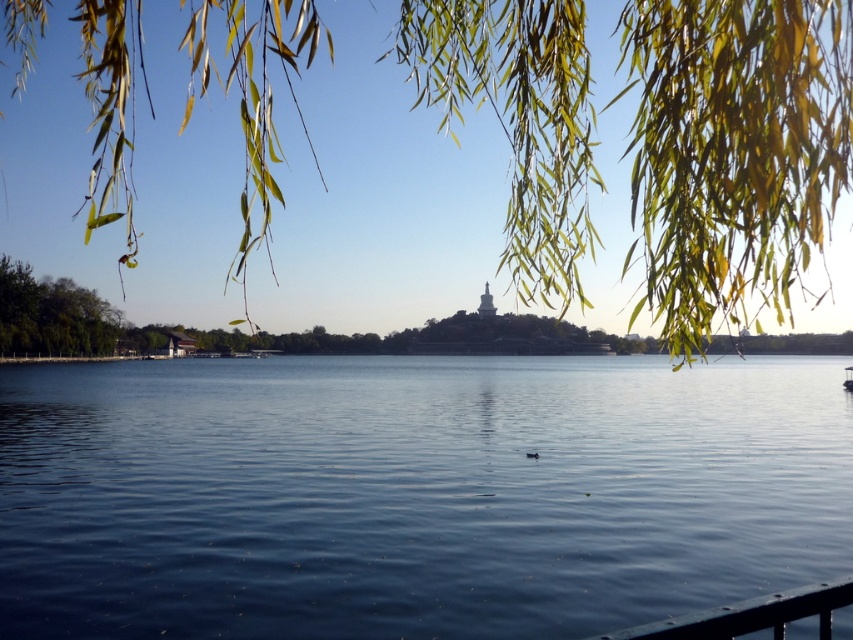
You are standing at the center of the lake and looking towards the green leafy willow at upper center. In which direction should you swim to reach it?

The green leafy willow at upper center is located at point coordinates that indicate it is positioned to the upper left from your current position at the lake center. Therefore, you should swim towards the upper left direction to reach it.

You are a photographer trying to capture the entire lakeside scene without any obstructions. You notice the green leafy willow at upper center. Based on its position, will it block your view of the lake? Please explain.

The green leafy willow at upper center is positioned at point (654, 145), which means it is located near the top left of the frame. This placement suggests it might partially block the upper left portion of the view but should not obstruct the central or lower areas of the lake, allowing you to capture most of the lakeside scene.